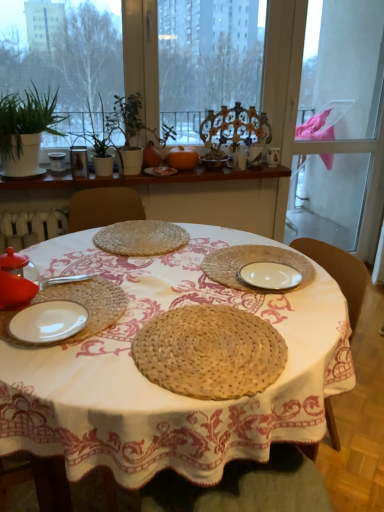
This screenshot has height=512, width=384. Find the location of `free space that is in between woven straw placemat at center, which ranks as the 2th plate in back-to-front order, and matte glass teapot at left, which ranks as the first tableware in bottom-to-top order`. free space that is in between woven straw placemat at center, which ranks as the 2th plate in back-to-front order, and matte glass teapot at left, which ranks as the first tableware in bottom-to-top order is located at coordinates pos(91,267).